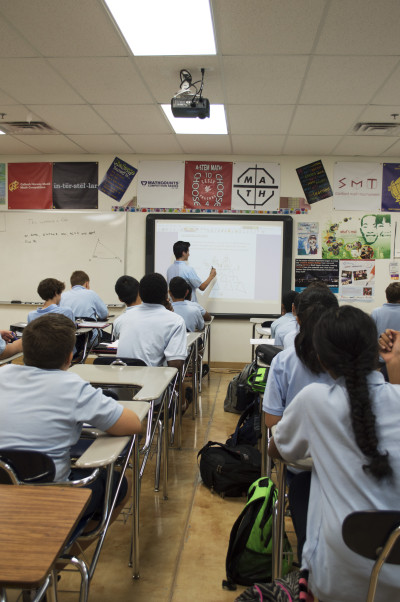
You are a GUI agent. You are given a task and a screenshot of the screen. Output one action in this format:
    pyautogui.click(x=<x>, y=<y>)
    Task: Click on the text on the whiteboard
    Image resolution: width=400 pixels, height=602 pixels.
    Given the screenshot: What is the action you would take?
    pyautogui.click(x=85, y=232), pyautogui.click(x=55, y=232), pyautogui.click(x=34, y=234)